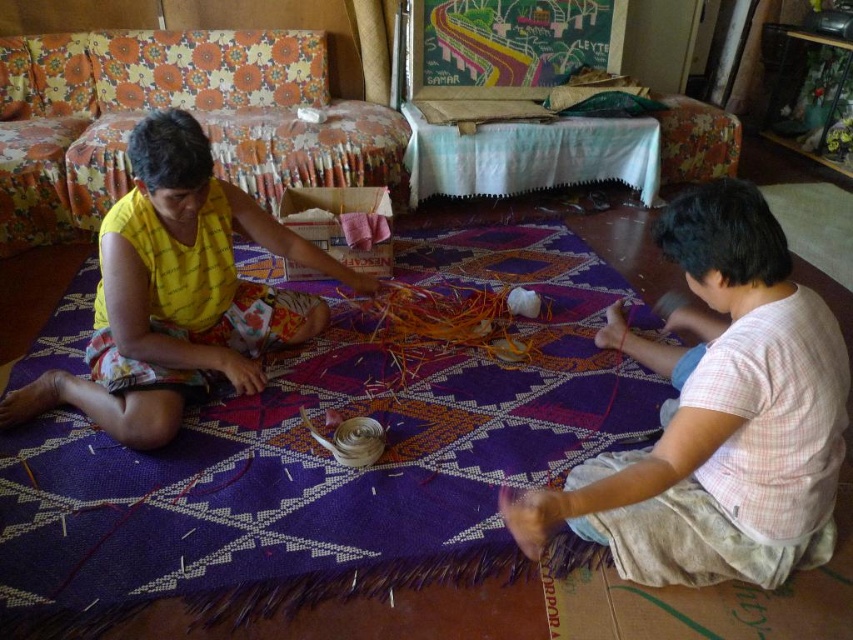
Does light pink plaid shirt at right have a greater width compared to yellow printed fabric at left?

No.

Is light pink plaid shirt at right smaller than yellow printed fabric at left?

Incorrect, light pink plaid shirt at right is not smaller in size than yellow printed fabric at left.

Which is behind, point (752, 276) or point (128, 230)?

The point (128, 230) is behind.

Where is `light pink plaid shirt at right`? The height and width of the screenshot is (640, 853). light pink plaid shirt at right is located at coordinates (718, 417).